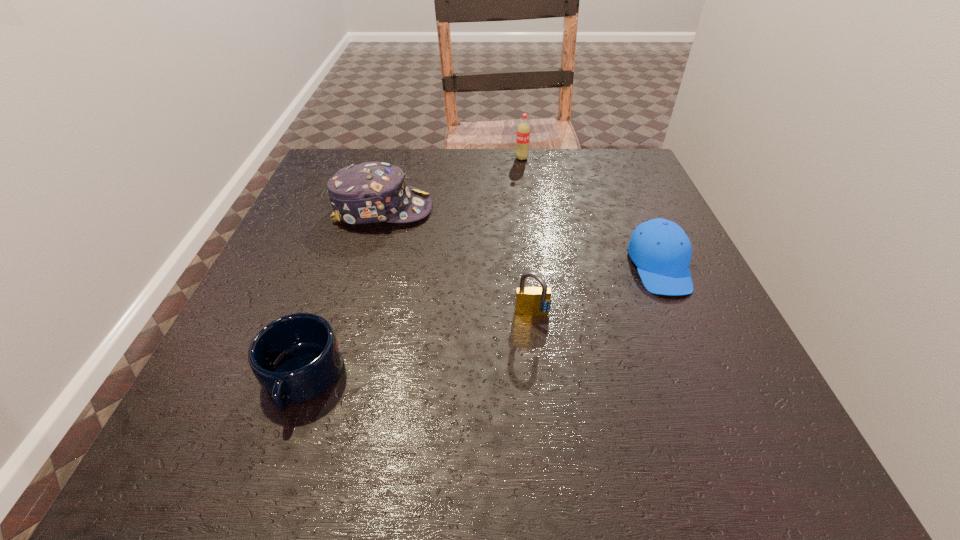
The image size is (960, 540). Find the location of `empty location between the mug and the soda`. empty location between the mug and the soda is located at coordinates (412, 268).

Identify the location of vacant point located between the left cap and the second nearest object. (458, 262).

You are a GUI agent. You are given a task and a screenshot of the screen. Output one action in this format:
    pyautogui.click(x=<x>, y=<y>)
    Task: Click on the empty space that is in between the second nearest object and the mug
    This screenshot has height=540, width=960.
    Given the screenshot: What is the action you would take?
    pyautogui.click(x=418, y=347)

Locate an element on the screen. vacant space that's between the soda and the taller cap is located at coordinates (452, 184).

Point out which object is positioned as the nearest to the right cap. Please provide its 2D coordinates. Your answer should be formatted as a tuple, i.e. [(x, y)], where the tuple contains the x and y coordinates of a point satisfying the conditions above.

[(531, 301)]

Select which object is the fourth closest to the nearest object. Please provide its 2D coordinates. Your answer should be formatted as a tuple, i.e. [(x, y)], where the tuple contains the x and y coordinates of a point satisfying the conditions above.

[(523, 130)]

The image size is (960, 540). Find the location of `vacant space that satisfies the following two spatial constraints: 1. on the front-facing side of the left cap; 2. with the handle on the side of the mug`. vacant space that satisfies the following two spatial constraints: 1. on the front-facing side of the left cap; 2. with the handle on the side of the mug is located at coordinates (334, 379).